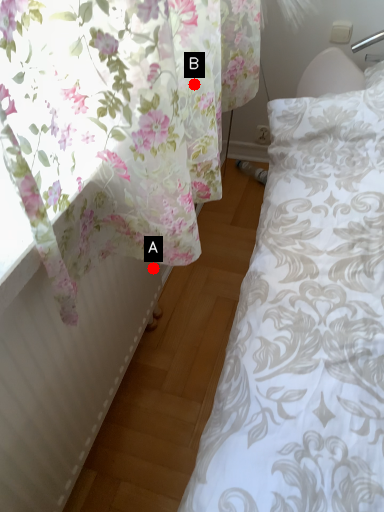
Question: Two points are circled on the image, labeled by A and B beside each circle. Which point is farther from the camera taking this photo?

Choices:
 (A) A is further
 (B) B is further

Answer: (A)